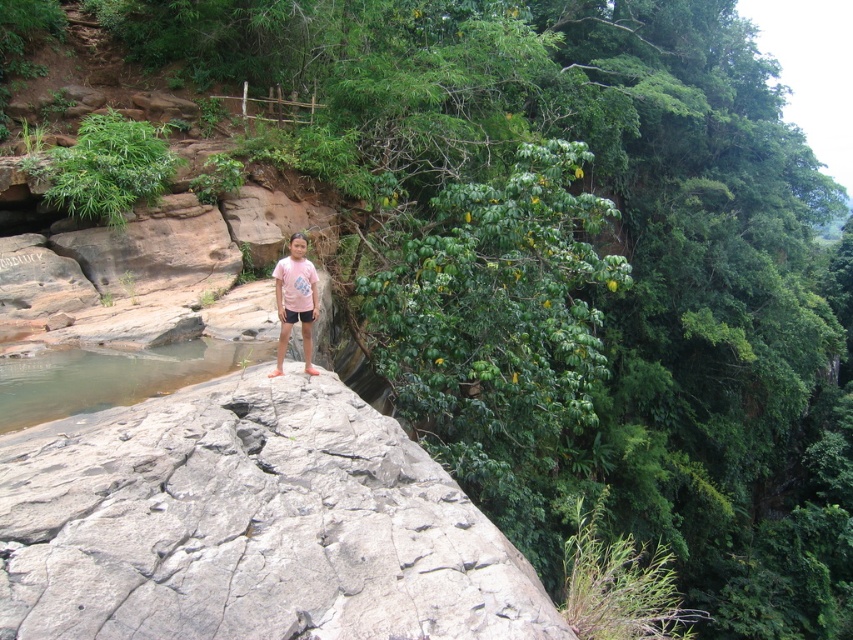
Does gray rough rock at center have a lesser width compared to clear water at rock edge?

No.

Identify the location of gray rough rock at center. The height and width of the screenshot is (640, 853). (250, 524).

Is point (252, 612) positioned behind point (7, 428)?

No.

I want to click on gray rough rock at center, so click(250, 524).